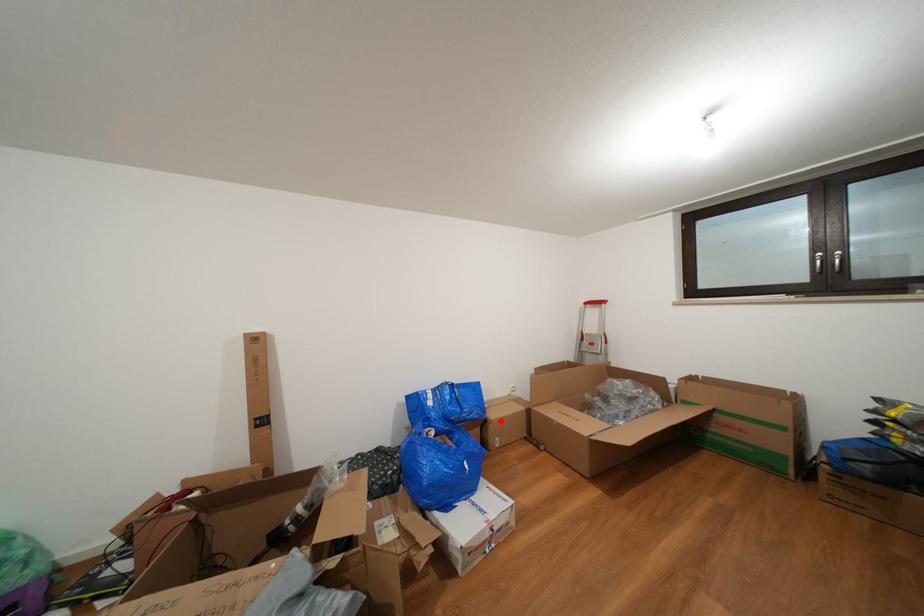
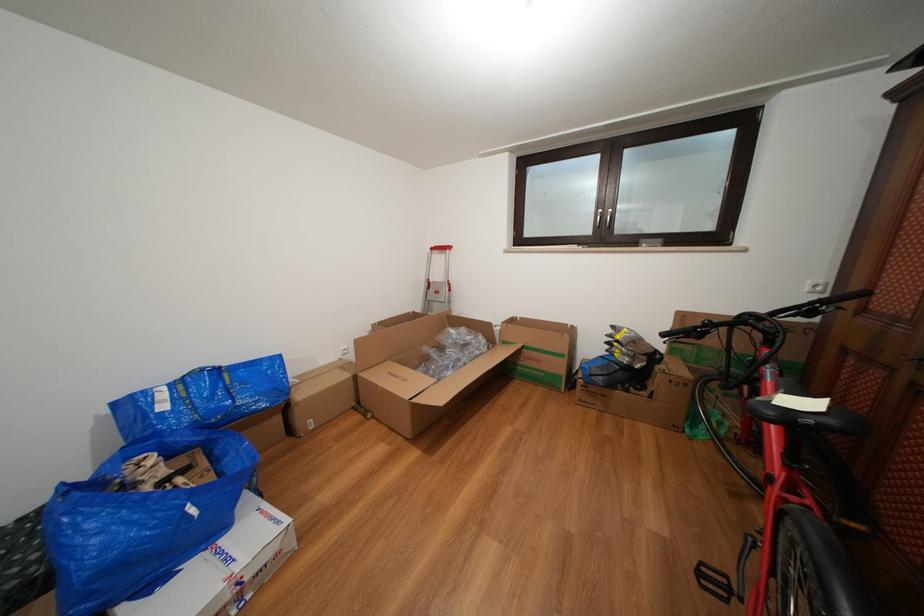
In the second image, find the point that corresponds to the highlighted location in the first image.

(309, 400)